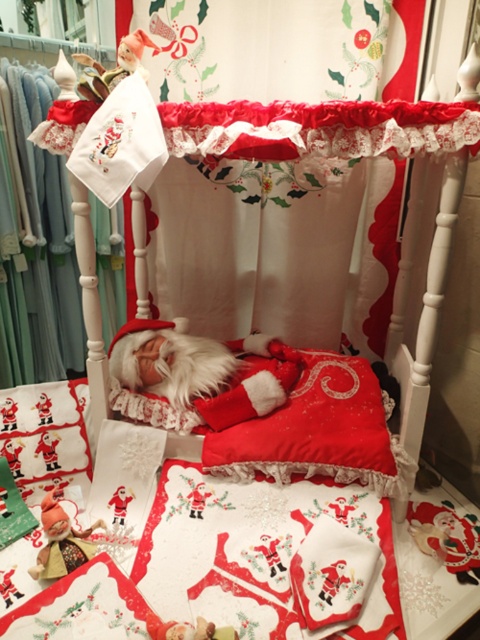
Question: Which object appears farthest from the camera in this image?

Choices:
 (A) matte red elf at lower left
 (B) white lace curtain at upper center

Answer: (B)

Question: Can you confirm if white lace curtain at upper center is positioned to the right of matte red elf at lower left?

Choices:
 (A) yes
 (B) no

Answer: (A)

Question: Does red velvet pillow at center appear on the left side of matte plastic doll at upper left?

Choices:
 (A) no
 (B) yes

Answer: (A)

Question: Which point is closer to the camera taking this photo?

Choices:
 (A) (126, 243)
 (B) (158, 632)
 (C) (217, 456)

Answer: (B)

Question: Estimate the real-world distances between objects in this image. Which object is closer to the matte red elf at lower left?

Choices:
 (A) matte plastic doll at upper left
 (B) red velvet pillow at center
 (C) white lace curtain at upper center

Answer: (B)

Question: Can you confirm if red velvet pillow at center is positioned to the right of matte plastic doll at upper left?

Choices:
 (A) no
 (B) yes

Answer: (B)